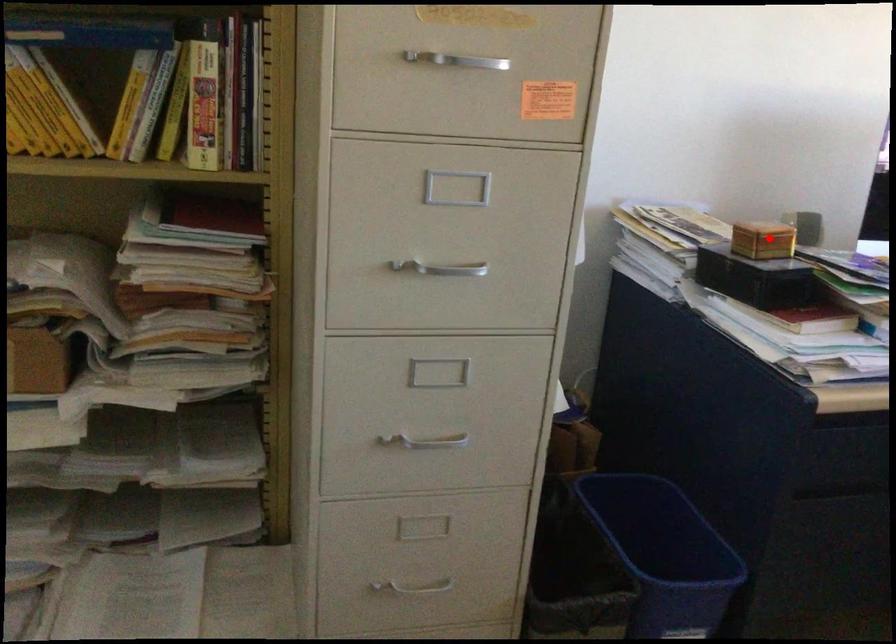
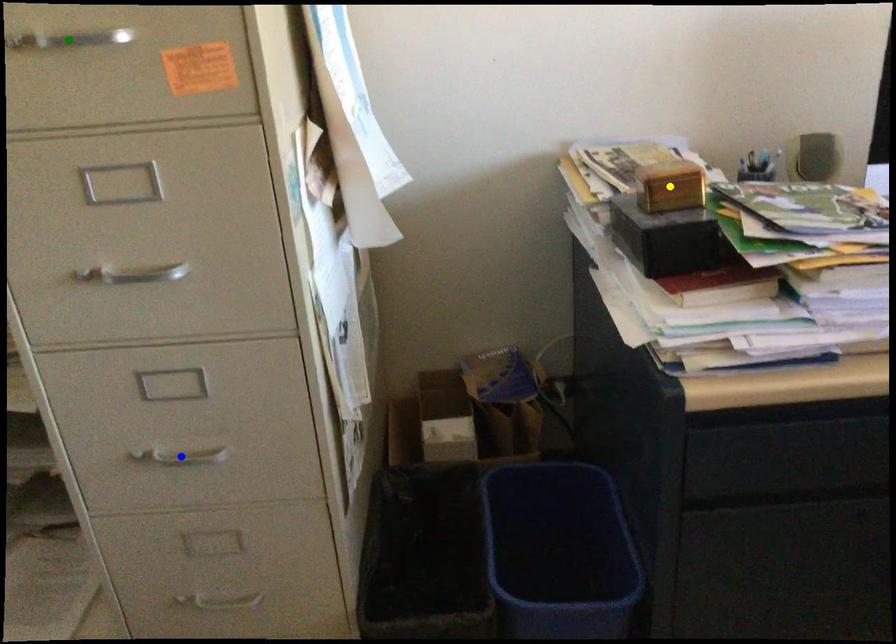
Question: I am providing you with two images of the same scene from different viewpoints. A red point is marked on the first image. You are given multiple points on the second image. Which spot in image 2 lines up with the point in image 1?

Choices:
 (A) blue point
 (B) yellow point
 (C) green point

Answer: (B)